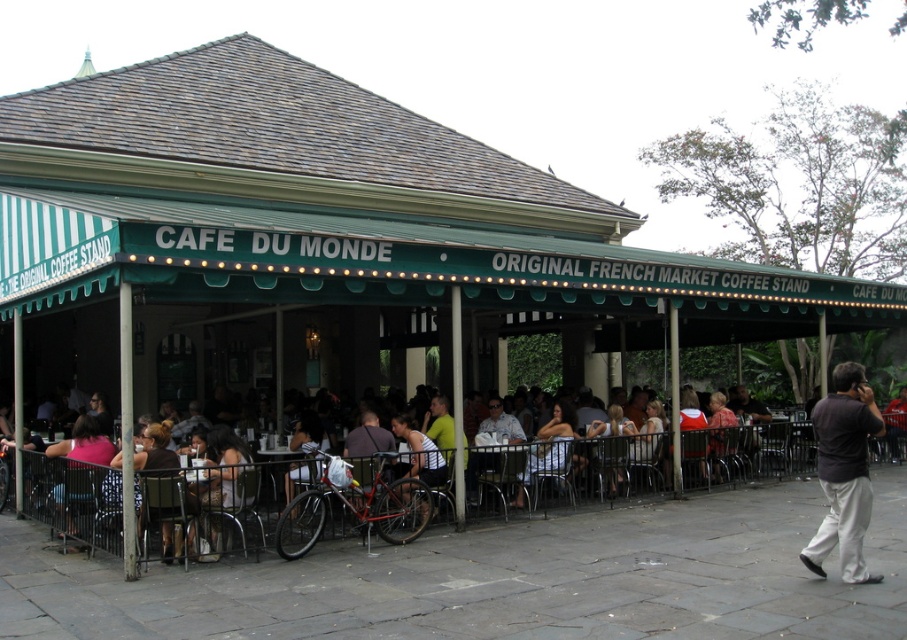
Question: Is white fabric dress at lower center below pink fabric shirt at lower left?

Choices:
 (A) no
 (B) yes

Answer: (B)

Question: Is matte black shirt at center closer to camera compared to white textured tank top at center?

Choices:
 (A) yes
 (B) no

Answer: (B)

Question: Which point is closer to the camera taking this photo?

Choices:
 (A) (431, 464)
 (B) (569, 419)
 (C) (310, 420)
 (D) (221, 541)

Answer: (D)

Question: Which of the following is the farthest from the observer?

Choices:
 (A) (298, 420)
 (B) (425, 456)
 (C) (98, 451)

Answer: (A)

Question: Does white textured tank top at center appear over pink fabric shirt at lower left?

Choices:
 (A) yes
 (B) no

Answer: (B)

Question: Which of these objects is positioned closest to the white textured tank top at center?

Choices:
 (A) matte black bicycle at center
 (B) gray fabric shirt at right
 (C) white fabric dress at lower center
 (D) matte black shirt at center

Answer: (D)